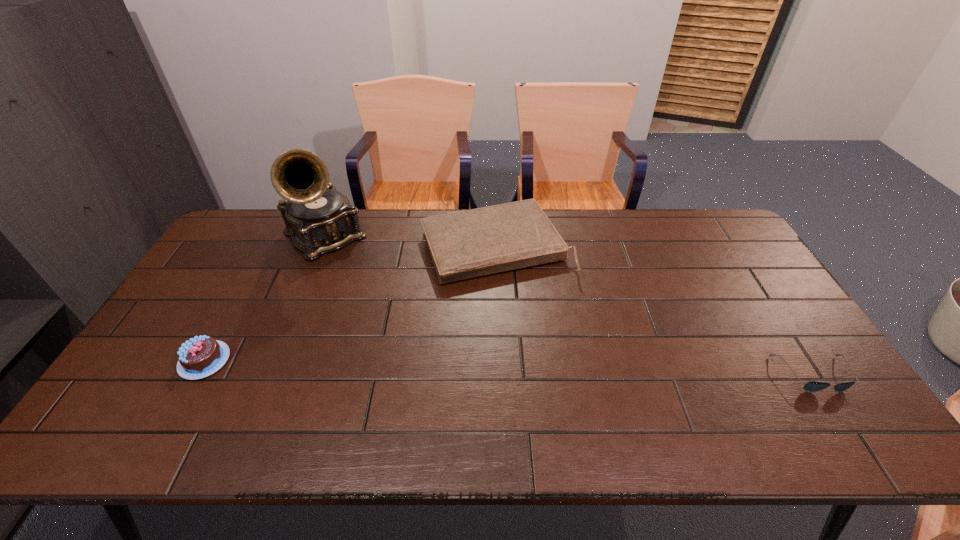
What are the coordinates of `vacant area that lies between the third object from left to right and the chocolate cake` in the screenshot? It's located at (349, 304).

This screenshot has width=960, height=540. What are the coordinates of `vacant area that lies between the shortest object and the chocolate cake` in the screenshot? It's located at (509, 367).

Find the location of a particular element. This screenshot has height=540, width=960. blank region between the phonograph record and the rightmost object is located at coordinates pyautogui.click(x=568, y=306).

The height and width of the screenshot is (540, 960). I want to click on free spot between the third object from left to right and the chocolate cake, so click(349, 304).

I want to click on free space that is in between the tallest object and the paperback book, so click(x=410, y=242).

You are a GUI agent. You are given a task and a screenshot of the screen. Output one action in this format:
    pyautogui.click(x=<x>, y=<y>)
    Task: Click on the vacant area that lies between the chocolate cake and the phonograph record
    
    Given the screenshot: What is the action you would take?
    pyautogui.click(x=264, y=299)

You are a GUI agent. You are given a task and a screenshot of the screen. Output one action in this format:
    pyautogui.click(x=<x>, y=<y>)
    Task: Click on the closest object relative to the sunglasses
    
    Given the screenshot: What is the action you would take?
    pyautogui.click(x=472, y=243)

Identify the location of object that can be found as the third closest to the third object from left to right. This screenshot has width=960, height=540. (812, 386).